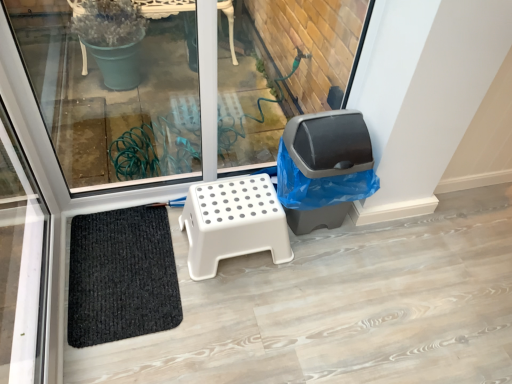
The height and width of the screenshot is (384, 512). I want to click on free space in front of white plastic stool at center, so click(x=233, y=317).